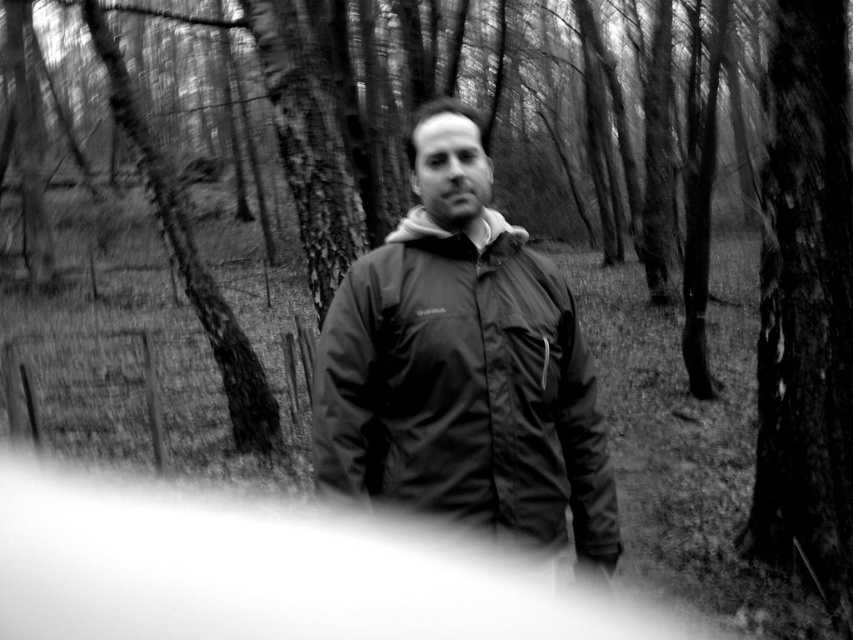
Can you confirm if matte black jacket at center is smaller than smooth bark tree at right?

Yes, matte black jacket at center is smaller than smooth bark tree at right.

Locate an element on the screen. The width and height of the screenshot is (853, 640). matte black jacket at center is located at coordinates (463, 388).

Does point (364, 269) come closer to viewer compared to point (838, 221)?

Yes, it is.

Where is `matte black jacket at center`? matte black jacket at center is located at coordinates (463, 388).